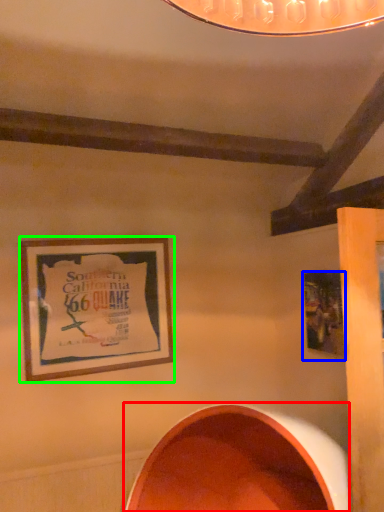
Question: Estimate the real-world distances between objects in this image. Which object is closer to oval (highlighted by a red box), picture frame (highlighted by a blue box) or picture frame (highlighted by a green box)?

Choices:
 (A) picture frame
 (B) picture frame

Answer: (A)